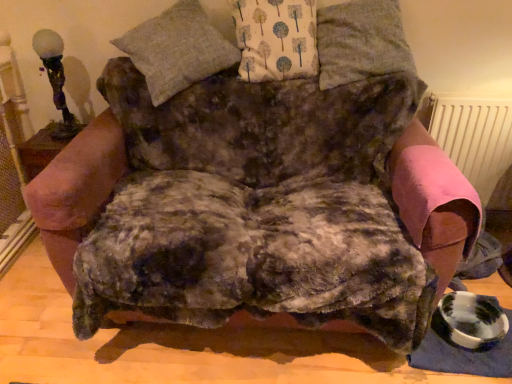
Question: In terms of size, does white fabric with tree pattern at upper center, which is the 2th pillow in right-to-left order, appear bigger or smaller than matte glass table lamp at upper left?

Choices:
 (A) small
 (B) big

Answer: (B)

Question: From their relative heights in the image, would you say white fabric with tree pattern at upper center, the 2th pillow viewed from the left, is taller or shorter than matte glass table lamp at upper left?

Choices:
 (A) short
 (B) tall

Answer: (A)

Question: Estimate the real-world distances between objects in this image. Which object is farther from the white fabric with tree pattern at upper center, which is the 2th pillow in right-to-left order?

Choices:
 (A) matte glass table lamp at upper left
 (B) pink fabric radiator at right
 (C) gray woolen pillow at upper center, which is the 3th pillow in right-to-left order
 (D) gray fabric pillow at upper center, which is the 3th pillow in left-to-right order

Answer: (A)

Question: Estimate the real-world distances between objects in this image. Which object is farther from the pink fabric radiator at right?

Choices:
 (A) white fabric with tree pattern at upper center, the 2th pillow viewed from the left
 (B) gray fabric pillow at upper center, the first pillow in the right-to-left sequence
 (C) matte glass table lamp at upper left
 (D) gray woolen pillow at upper center, which appears as the first pillow when viewed from the left

Answer: (C)